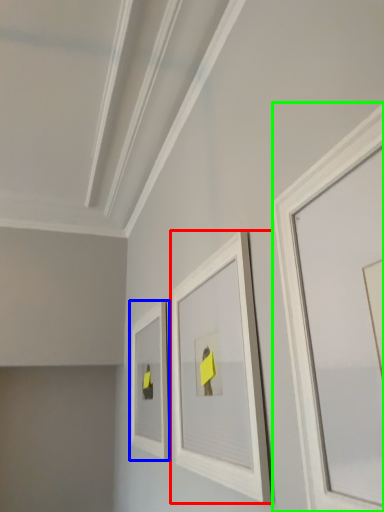
Question: Estimate the real-world distances between objects in this image. Which object is closer to picture frame (highlighted by a red box), picture frame (highlighted by a blue box) or picture frame (highlighted by a green box)?

Choices:
 (A) picture frame
 (B) picture frame

Answer: (B)